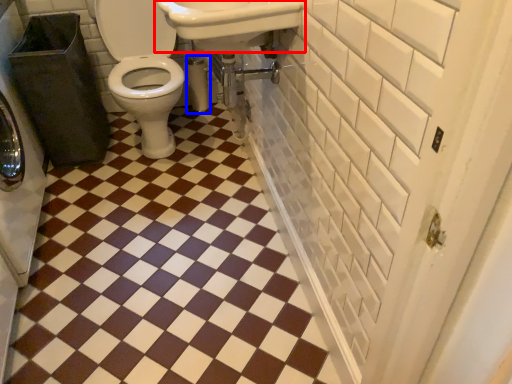
Question: Which object appears closest to the camera in this image, sink (highlighted by a red box) or toilet paper (highlighted by a blue box)?

Choices:
 (A) sink
 (B) toilet paper

Answer: (A)